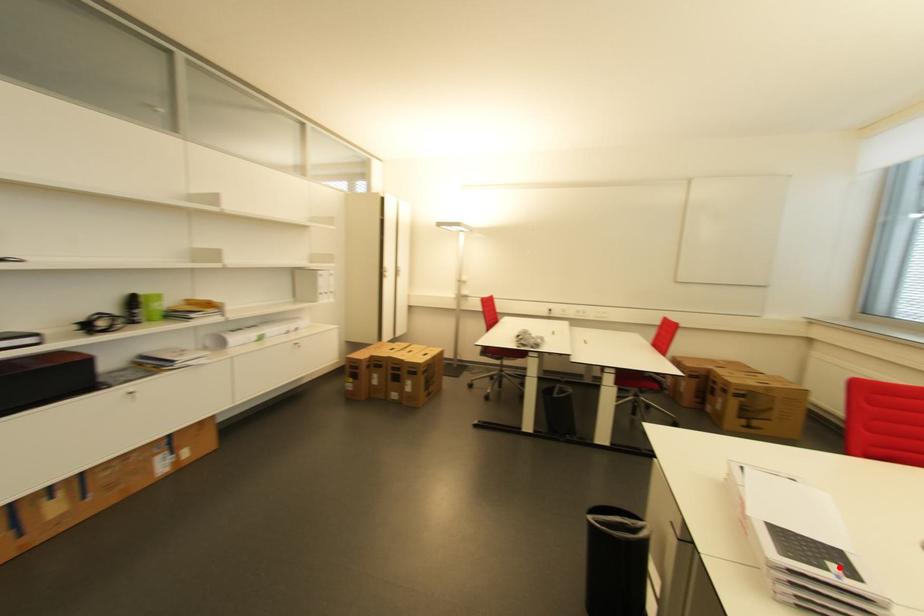
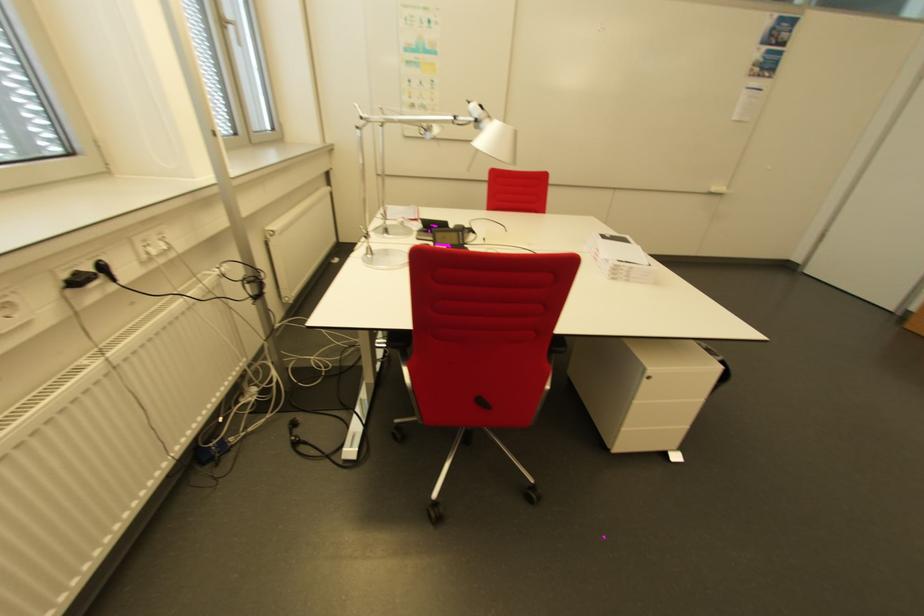
Find the pixel in the second image that matches the highlighted location in the first image.

(614, 237)